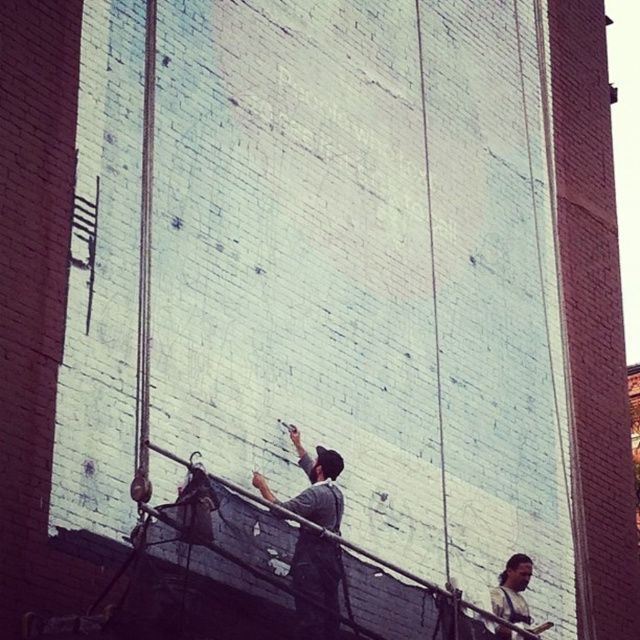
Question: Which of the following is the closest to the observer?

Choices:
 (A) dark brown leather jacket at lower right
 (B) dark gray fabric at center

Answer: (B)

Question: Which of the following is the farthest from the observer?

Choices:
 (A) dark gray fabric at center
 (B) dark brown leather jacket at lower right

Answer: (B)

Question: Can you confirm if dark gray fabric at center is bigger than dark brown leather jacket at lower right?

Choices:
 (A) no
 (B) yes

Answer: (B)

Question: Is dark gray fabric at center positioned before dark brown leather jacket at lower right?

Choices:
 (A) no
 (B) yes

Answer: (B)

Question: Can you confirm if dark gray fabric at center is bigger than dark brown leather jacket at lower right?

Choices:
 (A) yes
 (B) no

Answer: (A)